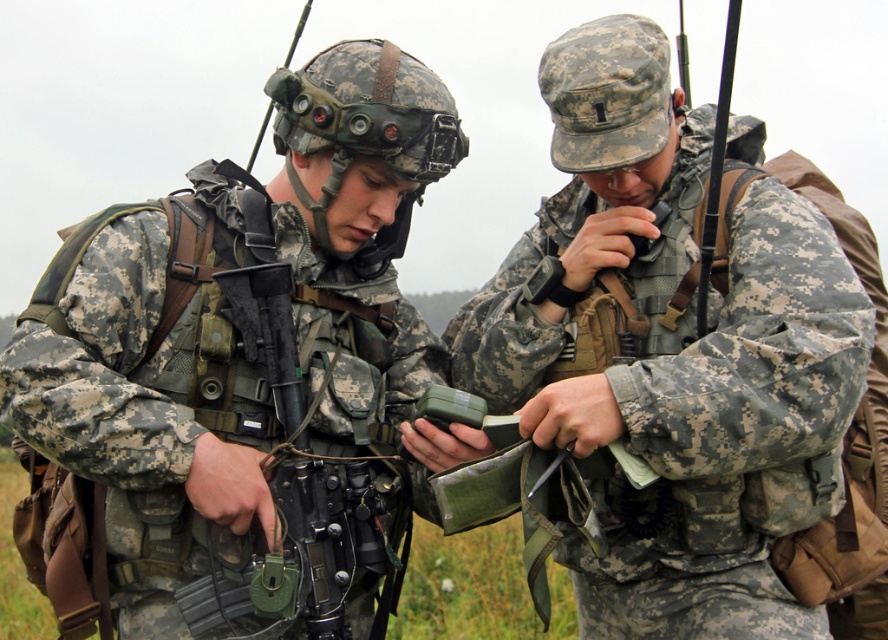
Can you confirm if camouflage uniform at center is taller than black matte rifle at center?

Yes, camouflage uniform at center is taller than black matte rifle at center.

Between point (335, 499) and point (280, 412), which one is positioned behind?

Point (280, 412)

Find the location of a particular element. camouflage uniform at center is located at coordinates (243, 369).

Is point (728, 525) closer to viewer compared to point (284, 376)?

That is False.

Who is more distant from viewer, [782,253] or [240,324]?

Positioned behind is point [240,324].

Is point (517, 296) closer to viewer compared to point (252, 301)?

No, it is not.

Image resolution: width=888 pixels, height=640 pixels. I want to click on camouflage fabric radio at center, so click(x=672, y=353).

Which is above, camouflage uniform at center or camouflage fabric radio at center?

Positioned higher is camouflage fabric radio at center.

Which is behind, point (369, 348) or point (521, 342)?

Point (521, 342)

Where is `camouflage uniform at center`? This screenshot has width=888, height=640. camouflage uniform at center is located at coordinates (243, 369).

The width and height of the screenshot is (888, 640). Find the location of `camouflage uniform at center`. camouflage uniform at center is located at coordinates (243, 369).